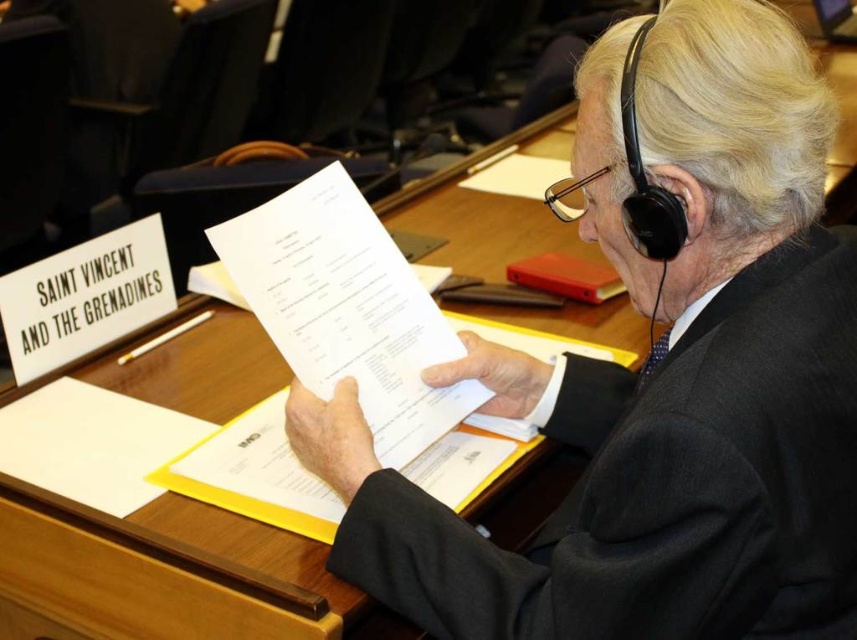
Question: Among these objects, which one is farthest from the camera?

Choices:
 (A) white paper at center
 (B) wooden table at center

Answer: (A)

Question: Can you confirm if wooden table at center is bigger than white paper at center?

Choices:
 (A) no
 (B) yes

Answer: (B)

Question: Estimate the real-world distances between objects in this image. Which object is closer to the black matte suit at center?

Choices:
 (A) white paper at center
 (B) wooden table at center

Answer: (A)

Question: Can you confirm if black matte suit at center is positioned to the left of white paper at center?

Choices:
 (A) yes
 (B) no

Answer: (B)

Question: Is black matte suit at center closer to the viewer compared to wooden table at center?

Choices:
 (A) yes
 (B) no

Answer: (A)

Question: Considering the real-world distances, which object is farthest from the white paper at center?

Choices:
 (A) wooden table at center
 (B) black matte suit at center

Answer: (A)